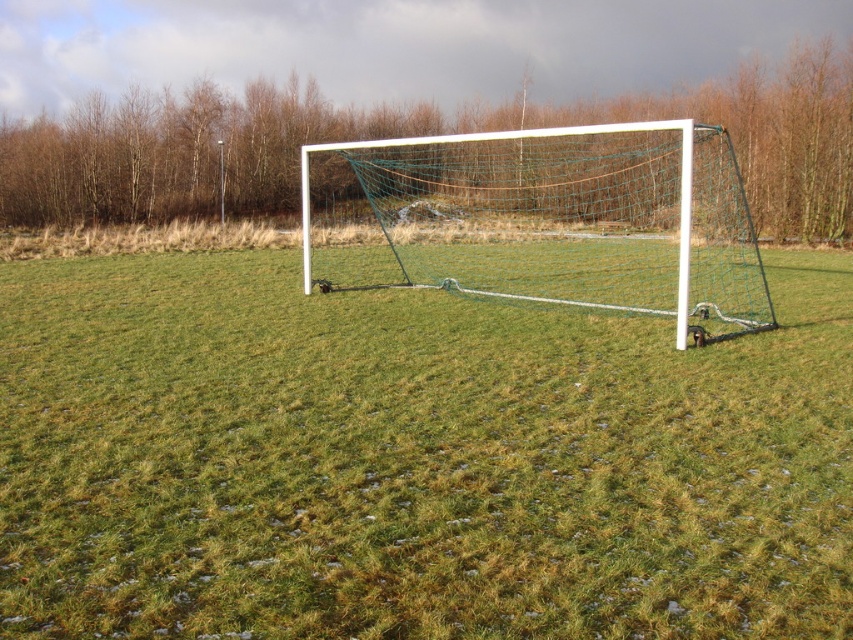
The height and width of the screenshot is (640, 853). What do you see at coordinates (413, 460) in the screenshot? I see `green grass at center` at bounding box center [413, 460].

Consider the image. Is green grass at center closer to the viewer compared to white plastic goal at center?

That is True.

What do you see at coordinates (413, 460) in the screenshot? The width and height of the screenshot is (853, 640). I see `green grass at center` at bounding box center [413, 460].

Where is `green grass at center`? The height and width of the screenshot is (640, 853). green grass at center is located at coordinates (413, 460).